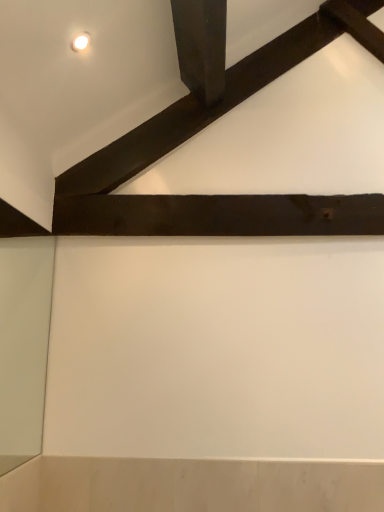
Identify the location of dark brown wood plank at center. (218, 215).

What do you see at coordinates (218, 215) in the screenshot?
I see `dark brown wood plank at center` at bounding box center [218, 215].

I want to click on dark brown wood plank at center, so click(x=218, y=215).